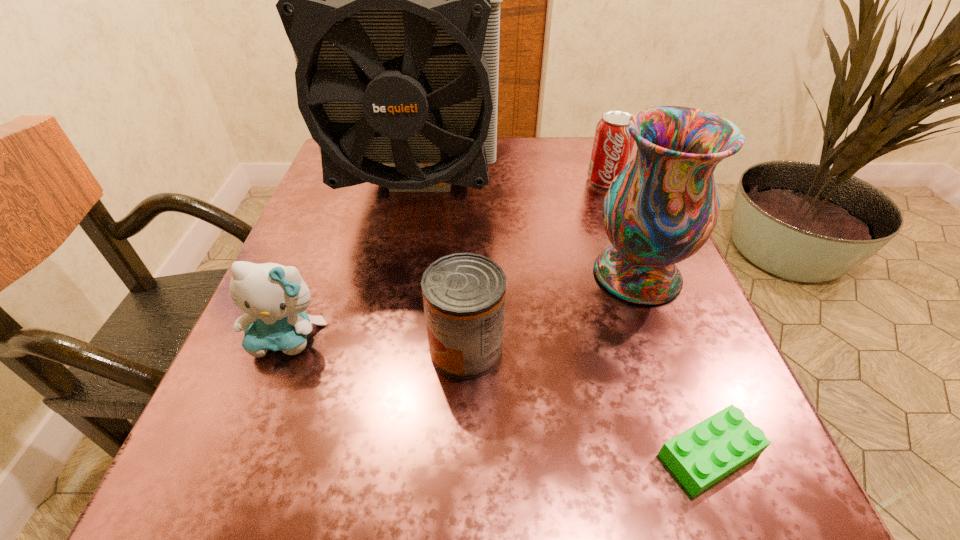
The width and height of the screenshot is (960, 540). I want to click on vacant space that satisfies the following two spatial constraints: 1. on the face of the kitten; 2. on the left side of the shortest object, so click(242, 454).

Image resolution: width=960 pixels, height=540 pixels. I want to click on vacant position in the image that satisfies the following two spatial constraints: 1. on the face of the Lego; 2. on the left side of the kitten, so click(x=242, y=454).

This screenshot has width=960, height=540. What are the coordinates of `vacant space that satisfies the following two spatial constraints: 1. on the face of the can; 2. on the left side of the kitten` in the screenshot? It's located at (283, 349).

Image resolution: width=960 pixels, height=540 pixels. Identify the location of free space that satisfies the following two spatial constraints: 1. on the back side of the fan; 2. on the left side of the soda can. (421, 180).

Where is `blank area in the image that satisfies the following two spatial constraints: 1. on the face of the kitten; 2. on the left side of the Lego`? The height and width of the screenshot is (540, 960). blank area in the image that satisfies the following two spatial constraints: 1. on the face of the kitten; 2. on the left side of the Lego is located at coordinates coord(242,454).

The width and height of the screenshot is (960, 540). Identify the location of free space that satisfies the following two spatial constraints: 1. on the face of the shortest object; 2. on the right side of the kitten. (242, 454).